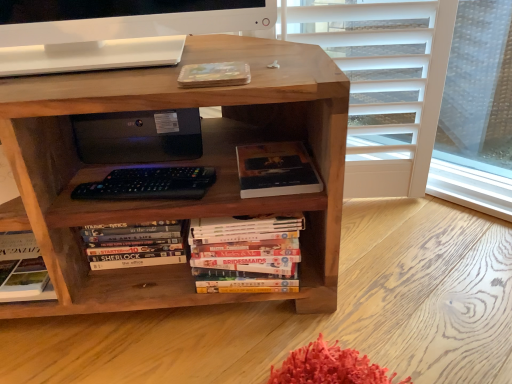
Locate an element on the screen. The width and height of the screenshot is (512, 384). hardcover books at center, the second book in the left-to-right sequence is located at coordinates (246, 253).

The height and width of the screenshot is (384, 512). I want to click on brown wood bookcase at center, so (177, 164).

From a real-world perspective, is hardcover books at center, the second book in the left-to-right sequence, physically below black matte computer at center?

Yes, from a real-world perspective, hardcover books at center, the second book in the left-to-right sequence, is under black matte computer at center.

Would you consider hardcover books at center, which is the second book from right to left, to be distant from black matte computer at center?

hardcover books at center, which is the second book from right to left, is near black matte computer at center, not far away.

From the image's perspective, between hardcover books at center, the second book in the left-to-right sequence, and black matte computer at center, which one is located above?

From the image's view, black matte computer at center is above.

Relative to hardcover book at center, marked as the first book in a right-to-left arrangement, is black matte computer at center in front or behind?

black matte computer at center is behind hardcover book at center, marked as the first book in a right-to-left arrangement.

Is black matte computer at center at the right side of hardcover book at center, the 3th book when ordered from left to right?

In fact, black matte computer at center is to the left of hardcover book at center, the 3th book when ordered from left to right.

At what (x,y) coordinates should I click in order to perform the action: click on the 2nd book counting from the right of the black matte computer at center. Please return your answer as a coordinate pair (x, y). Looking at the image, I should click on (276, 170).

From a real-world perspective, which object stands above the other?

black matte computer at center.

Is hardcover book at center, which ranks as the 3th book in right-to-left order, bigger than black matte computer at center?

No.

Which is behind, point (101, 228) or point (142, 135)?

The point (142, 135) is more distant.

Is hardcover book at center, the 1th book positioned from the left, oriented away from black matte computer at center?

No, hardcover book at center, the 1th book positioned from the left, is not facing the opposite direction of black matte computer at center.

Is hardcover book at center, which ranks as the 3th book in right-to-left order, wider than black matte computer at center?

In fact, hardcover book at center, which ranks as the 3th book in right-to-left order, might be narrower than black matte computer at center.

In the image, is brown wood bookcase at center positioned in front of or behind hardcover book at center, marked as the first book in a right-to-left arrangement?

Visually, brown wood bookcase at center is located in front of hardcover book at center, marked as the first book in a right-to-left arrangement.

From a real-world perspective, who is located lower, brown wood bookcase at center or hardcover book at center, the 3th book when ordered from left to right?

In real-world perspective, brown wood bookcase at center is lower.

Can you confirm if brown wood bookcase at center is smaller than hardcover book at center, the 3th book when ordered from left to right?

Incorrect, brown wood bookcase at center is not smaller in size than hardcover book at center, the 3th book when ordered from left to right.

Considering the relative sizes of brown wood bookcase at center and hardcover book at center, the 3th book when ordered from left to right, in the image provided, is brown wood bookcase at center wider than hardcover book at center, the 3th book when ordered from left to right,?

Correct, the width of brown wood bookcase at center exceeds that of hardcover book at center, the 3th book when ordered from left to right.

Considering the points (313, 192) and (314, 273), which point is in front, point (313, 192) or point (314, 273)?

Point (313, 192)

Which is correct: hardcover book at center, marked as the first book in a right-to-left arrangement, is inside brown wood bookcase at center, or outside of it?

hardcover book at center, marked as the first book in a right-to-left arrangement, is spatially positioned inside brown wood bookcase at center.

Find the location of `book above the brown wood bookcase at center (from a real-world perspective)`. book above the brown wood bookcase at center (from a real-world perspective) is located at coordinates (276, 170).

Can you confirm if hardcover book at center, the 3th book when ordered from left to right, is positioned to the left of brown wood bookcase at center?

No, hardcover book at center, the 3th book when ordered from left to right, is not to the left of brown wood bookcase at center.

Can hardcover books at center, which is the second book from right to left, be found inside hardcover book at center, the 1th book positioned from the left?

That's incorrect, hardcover books at center, which is the second book from right to left, is not inside hardcover book at center, the 1th book positioned from the left.

Is hardcover book at center, the 1th book positioned from the left, taller or shorter than hardcover books at center, the second book in the left-to-right sequence?

hardcover book at center, the 1th book positioned from the left, is shorter than hardcover books at center, the second book in the left-to-right sequence.

Between hardcover book at center, the 1th book positioned from the left, and hardcover books at center, which is the second book from right to left, which one has smaller width?

With smaller width is hardcover book at center, the 1th book positioned from the left.

From the image's perspective, between hardcover book at center, which ranks as the 3th book in right-to-left order, and hardcover books at center, the second book in the left-to-right sequence, which one is located above?

hardcover book at center, which ranks as the 3th book in right-to-left order, appears higher in the image.

Considering the relative sizes of brown wood bookcase at center and hardcover book at center, the 1th book positioned from the left, in the image provided, is brown wood bookcase at center thinner than hardcover book at center, the 1th book positioned from the left,?

In fact, brown wood bookcase at center might be wider than hardcover book at center, the 1th book positioned from the left.

Looking at this image, from a real-world perspective, which is physically above, brown wood bookcase at center or hardcover book at center, which ranks as the 3th book in right-to-left order?

brown wood bookcase at center is physically above.

Are brown wood bookcase at center and hardcover book at center, which ranks as the 3th book in right-to-left order, beside each other?

No, brown wood bookcase at center is not in contact with hardcover book at center, which ranks as the 3th book in right-to-left order.

Locate an element on the screen. computer that appears behind the hardcover books at center, which is the second book from right to left is located at coordinates (138, 136).

This screenshot has height=384, width=512. Find the location of `book that is the 1st one when counting forward from the black matte computer at center`. book that is the 1st one when counting forward from the black matte computer at center is located at coordinates (276, 170).

Based on their spatial positions, is brown wood bookcase at center or hardcover books at center, which is the second book from right to left, further from hardcover book at center, the 3th book when ordered from left to right?

brown wood bookcase at center is further to hardcover book at center, the 3th book when ordered from left to right.

When comparing their distances from brown wood bookcase at center, does hardcover books at center, the second book in the left-to-right sequence, or hardcover book at center, the 3th book when ordered from left to right, seem closer?

hardcover books at center, the second book in the left-to-right sequence, is positioned closer to the anchor brown wood bookcase at center.

Which object lies further to the anchor point black matte computer at center, hardcover book at center, which ranks as the 3th book in right-to-left order, or hardcover books at center, which is the second book from right to left?

hardcover books at center, which is the second book from right to left, lies further to black matte computer at center than the other object.

Which object lies nearer to the anchor point hardcover books at center, the second book in the left-to-right sequence, brown wood bookcase at center or hardcover book at center, the 1th book positioned from the left?

Based on the image, hardcover book at center, the 1th book positioned from the left, appears to be nearer to hardcover books at center, the second book in the left-to-right sequence.

From the image, which object appears to be farther from black matte computer at center, hardcover book at center, marked as the first book in a right-to-left arrangement, or hardcover books at center, which is the second book from right to left?

hardcover books at center, which is the second book from right to left, lies further to black matte computer at center than the other object.

Which object lies nearer to the anchor point hardcover book at center, the 1th book positioned from the left, hardcover books at center, the second book in the left-to-right sequence, or hardcover book at center, marked as the first book in a right-to-left arrangement?

hardcover books at center, the second book in the left-to-right sequence.

Looking at this image, from the image, which object appears to be nearer to hardcover book at center, which ranks as the 3th book in right-to-left order, hardcover book at center, marked as the first book in a right-to-left arrangement, or hardcover books at center, the second book in the left-to-right sequence?

Among the two, hardcover books at center, the second book in the left-to-right sequence, is located nearer to hardcover book at center, which ranks as the 3th book in right-to-left order.

Based on their spatial positions, is hardcover book at center, which ranks as the 3th book in right-to-left order, or brown wood bookcase at center closer to black matte computer at center?

hardcover book at center, which ranks as the 3th book in right-to-left order, lies closer to black matte computer at center than the other object.

Locate an element on the screen. The height and width of the screenshot is (384, 512). book situated between hardcover book at center, the 1th book positioned from the left, and hardcover book at center, marked as the first book in a right-to-left arrangement, from left to right is located at coordinates (246, 253).

The height and width of the screenshot is (384, 512). I want to click on book between black matte computer at center and hardcover book at center, marked as the first book in a right-to-left arrangement, in the horizontal direction, so click(x=246, y=253).

Locate an element on the screen. The width and height of the screenshot is (512, 384). computer between hardcover book at center, the 1th book positioned from the left, and hardcover book at center, the 3th book when ordered from left to right, in the horizontal direction is located at coordinates (138, 136).

Find the location of a particular element. Image resolution: width=512 pixels, height=384 pixels. computer between brown wood bookcase at center and hardcover book at center, the 3th book when ordered from left to right, in the horizontal direction is located at coordinates [138, 136].